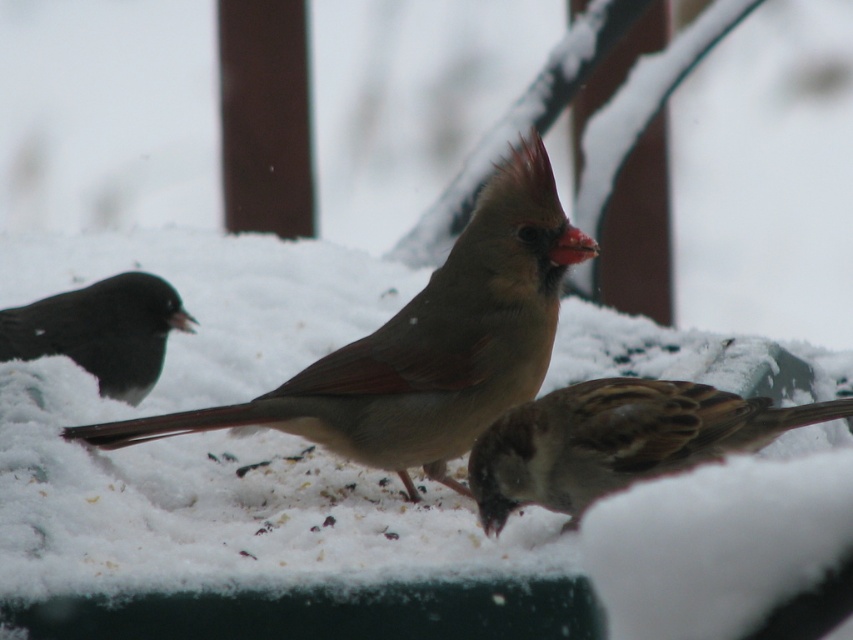
Question: Which of the following is the closest to the observer?

Choices:
 (A) black matte bird at left
 (B) brown speckled sparrow at lower right
 (C) brown speckled sparrow at center

Answer: (B)

Question: Is brown speckled sparrow at center bigger than brown speckled sparrow at lower right?

Choices:
 (A) no
 (B) yes

Answer: (B)

Question: Does brown speckled sparrow at center have a smaller size compared to black matte bird at left?

Choices:
 (A) yes
 (B) no

Answer: (B)

Question: Is brown speckled sparrow at center thinner than black matte bird at left?

Choices:
 (A) no
 (B) yes

Answer: (A)

Question: Among these objects, which one is farthest from the camera?

Choices:
 (A) brown speckled sparrow at lower right
 (B) brown speckled sparrow at center

Answer: (B)

Question: Which point is farther from the camera taking this photo?

Choices:
 (A) (463, 278)
 (B) (115, 390)
 (C) (642, 381)

Answer: (B)